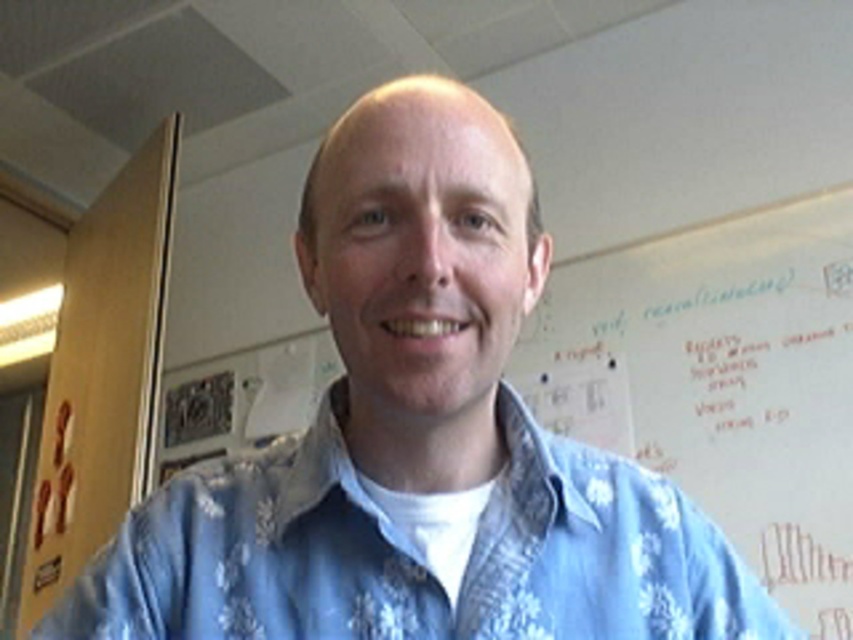
Is blue floral shirt at center below white paper at upper center?

No, blue floral shirt at center is not below white paper at upper center.

Looking at this image, is blue floral shirt at center bigger than white paper at upper center?

Incorrect, blue floral shirt at center is not larger than white paper at upper center.

Locate an element on the screen. The height and width of the screenshot is (640, 853). blue floral shirt at center is located at coordinates (415, 561).

The height and width of the screenshot is (640, 853). In order to click on blue floral shirt at center in this screenshot , I will do `click(415, 561)`.